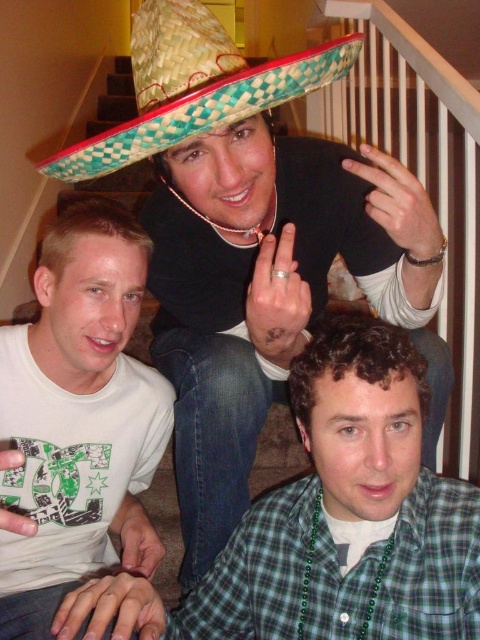
Can you confirm if white printed t-shirt at lower left is positioned to the right of woven straw sombrero at upper center?

Incorrect, white printed t-shirt at lower left is not on the right side of woven straw sombrero at upper center.

Consider the image. Is white printed t-shirt at lower left to the left of woven straw sombrero at upper center from the viewer's perspective?

Yes, white printed t-shirt at lower left is to the left of woven straw sombrero at upper center.

What do you see at coordinates (78, 419) in the screenshot? Image resolution: width=480 pixels, height=640 pixels. I see `white printed t-shirt at lower left` at bounding box center [78, 419].

Where is `white printed t-shirt at lower left`? The image size is (480, 640). white printed t-shirt at lower left is located at coordinates (78, 419).

Can you confirm if green plaid shirt at lower right is taller than woven straw sombrero at upper center?

Indeed, green plaid shirt at lower right has a greater height compared to woven straw sombrero at upper center.

Does green plaid shirt at lower right appear on the right side of woven straw sombrero at upper center?

Correct, you'll find green plaid shirt at lower right to the right of woven straw sombrero at upper center.

Does point (415, 586) lie behind point (171, 32)?

That is True.

This screenshot has width=480, height=640. Identify the location of green plaid shirt at lower right. (349, 515).

Is green plaid shirt at lower right closer to the viewer compared to white printed t-shirt at lower left?

Yes, it is in front of white printed t-shirt at lower left.

Can you confirm if green plaid shirt at lower right is shorter than white printed t-shirt at lower left?

Yes, green plaid shirt at lower right is shorter than white printed t-shirt at lower left.

The image size is (480, 640). In order to click on green plaid shirt at lower right in this screenshot , I will do `click(349, 515)`.

This screenshot has width=480, height=640. Identify the location of green plaid shirt at lower right. (349, 515).